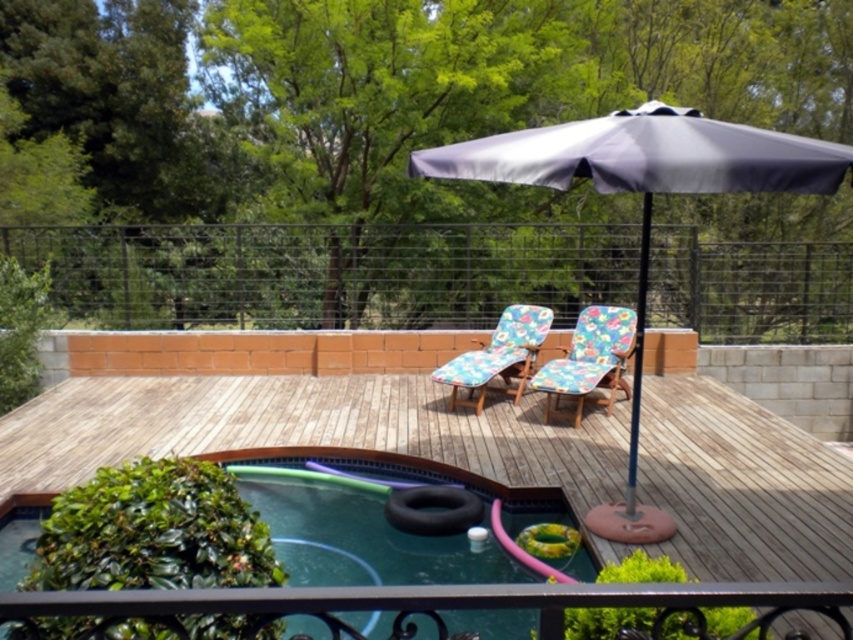
Can you confirm if gray fabric umbrella at upper center is wider than black metal rail at lower center?

Yes, gray fabric umbrella at upper center is wider than black metal rail at lower center.

Between point (683, 166) and point (596, 588), which one is positioned behind?

Point (683, 166)

Does point (641, 532) come behind point (672, 595)?

Yes, it is behind point (672, 595).

Find the location of a particular element. The image size is (853, 640). gray fabric umbrella at upper center is located at coordinates (643, 205).

Is smooth green rubber at lower center to the right of floral fabric beach chair at center from the viewer's perspective?

No, smooth green rubber at lower center is not to the right of floral fabric beach chair at center.

In order to click on smooth green rubber at lower center in this screenshot , I will do point(379,524).

Between point (648, 156) and point (462, 360), which one is positioned behind?

The point (462, 360) is more distant.

Can you confirm if gray fabric umbrella at upper center is thinner than floral fabric beach chair at center?

In fact, gray fabric umbrella at upper center might be wider than floral fabric beach chair at center.

Is point (572, 148) in front of point (527, 362)?

Yes, it is.

I want to click on gray fabric umbrella at upper center, so click(x=643, y=205).